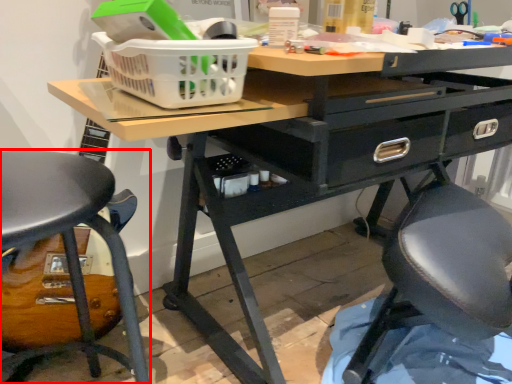
Question: From the image's perspective, considering the relative positions of chair (annotated by the red box) and basket in the image provided, where is chair (annotated by the red box) located with respect to the staircase?

Choices:
 (A) above
 (B) below

Answer: (B)